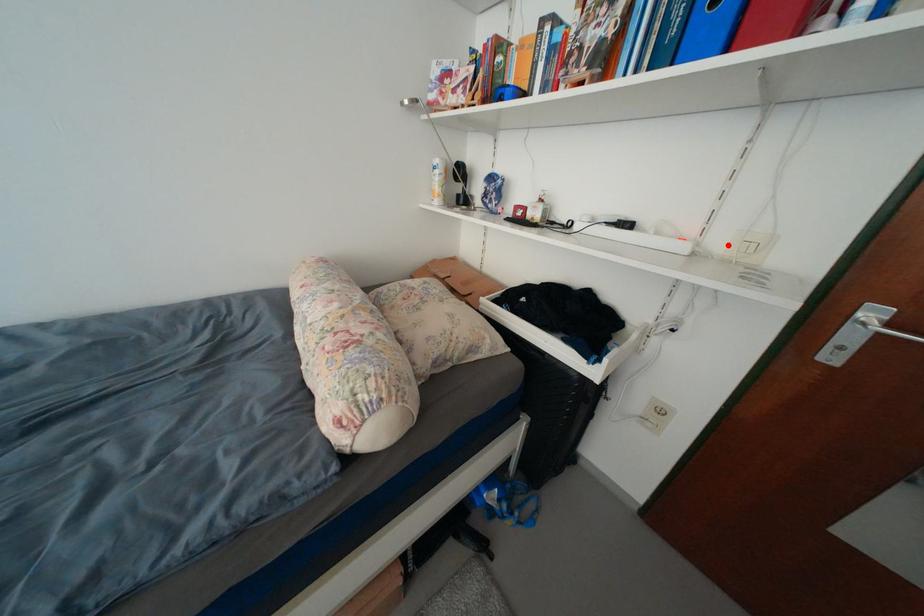
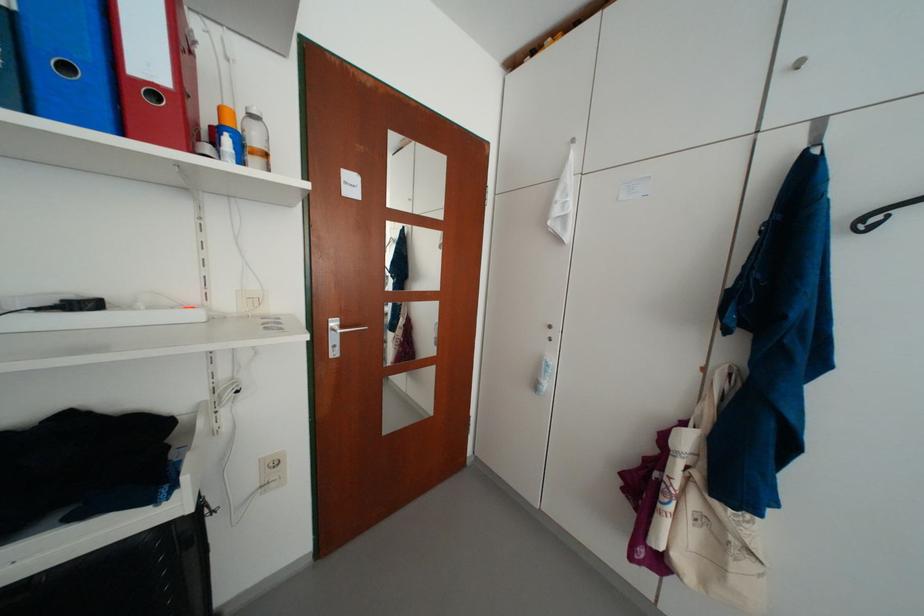
The point at the highlighted location is marked in the first image. Where is the corresponding point in the second image?

(236, 306)